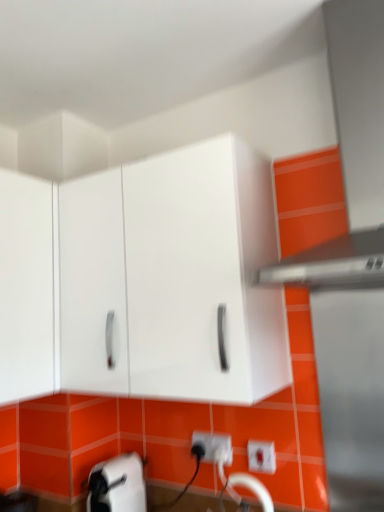
The width and height of the screenshot is (384, 512). What do you see at coordinates (350, 155) in the screenshot?
I see `satin silver exhaust hood at upper right` at bounding box center [350, 155].

The image size is (384, 512). Find the location of `white plastic electric outlet at lower center`. white plastic electric outlet at lower center is located at coordinates (213, 445).

The height and width of the screenshot is (512, 384). I want to click on white glossy cabinet at upper center, so click(x=173, y=277).

From a real-world perspective, is white plastic electric outlet at lower center located higher than satin silver exhaust hood at upper right?

Actually, white plastic electric outlet at lower center is physically below satin silver exhaust hood at upper right in the real world.

Is satin silver exhaust hood at upper right surrounded by white plastic electric outlet at lower center?

Actually, satin silver exhaust hood at upper right is outside white plastic electric outlet at lower center.

The width and height of the screenshot is (384, 512). I want to click on exhaust hood above the white plastic electric outlet at lower center (from the image's perspective), so click(x=350, y=155).

How far apart are white plastic electric outlet at lower center and satin silver exhaust hood at upper right?

They are 95.47 centimeters apart.

Considering the positions of objects white plastic electric outlet at lower center and white glossy cabinet at upper center in the image provided, who is in front, white plastic electric outlet at lower center or white glossy cabinet at upper center?

white glossy cabinet at upper center is more forward.

The height and width of the screenshot is (512, 384). Find the location of `cabinetry above the white plastic electric outlet at lower center (from the image's perspective)`. cabinetry above the white plastic electric outlet at lower center (from the image's perspective) is located at coordinates (173, 277).

Which is closer to the camera, (212,433) or (107,369)?

Point (212,433) is positioned farther from the camera compared to point (107,369).

Is white plastic electric outlet at lower center aimed at white glossy cabinet at upper center?

No, white plastic electric outlet at lower center is not oriented towards white glossy cabinet at upper center.

How different are the orientations of satin silver exhaust hood at upper right and white plastic electric outlet at lower center in degrees?

The facing directions of satin silver exhaust hood at upper right and white plastic electric outlet at lower center are 0.00731 degrees apart.

Does satin silver exhaust hood at upper right have a greater height compared to white plastic electric outlet at lower center?

Yes.

Is white plastic electric outlet at lower center a part of satin silver exhaust hood at upper right?

No, white plastic electric outlet at lower center is not surrounded by satin silver exhaust hood at upper right.

From the image's perspective, is satin silver exhaust hood at upper right located beneath white plastic electric outlet at lower center?

No, from the image's perspective, satin silver exhaust hood at upper right is not beneath white plastic electric outlet at lower center.

From the image's perspective, does white glossy cabinet at upper center appear higher than satin silver exhaust hood at upper right?

Incorrect, from the image's perspective, white glossy cabinet at upper center is lower than satin silver exhaust hood at upper right.

Is white glossy cabinet at upper center situated inside satin silver exhaust hood at upper right or outside?

white glossy cabinet at upper center is spatially situated outside satin silver exhaust hood at upper right.

Does white glossy cabinet at upper center have a lesser height compared to satin silver exhaust hood at upper right?

Indeed, white glossy cabinet at upper center has a lesser height compared to satin silver exhaust hood at upper right.

Which is behind, white glossy cabinet at upper center or white plastic electric outlet at lower center?

Positioned behind is white plastic electric outlet at lower center.

Looking at this image, from a real-world perspective, which object rests below the other?

In real-world perspective, white plastic electric outlet at lower center is lower.

Which of these two, satin silver exhaust hood at upper right or white glossy cabinet at upper center, is wider?

With larger width is satin silver exhaust hood at upper right.

Is satin silver exhaust hood at upper right not inside white glossy cabinet at upper center?

Yes, satin silver exhaust hood at upper right is not within white glossy cabinet at upper center.

From the image's perspective, which object appears higher, satin silver exhaust hood at upper right or white glossy cabinet at upper center?

satin silver exhaust hood at upper right, from the image's perspective.

From the picture: From a real-world perspective, is satin silver exhaust hood at upper right positioned above or below white glossy cabinet at upper center?

From a real-world perspective, satin silver exhaust hood at upper right is physically above white glossy cabinet at upper center.

This screenshot has width=384, height=512. I want to click on exhaust hood in front of the white plastic electric outlet at lower center, so click(350, 155).

Where is `cabinetry on the left of the white plastic electric outlet at lower center`? cabinetry on the left of the white plastic electric outlet at lower center is located at coordinates (173, 277).

Considering their positions, is white plastic electric outlet at lower center positioned further to white glossy cabinet at upper center than satin silver exhaust hood at upper right?

white plastic electric outlet at lower center.

When comparing their distances from white glossy cabinet at upper center, does satin silver exhaust hood at upper right or white plastic electric outlet at lower center seem further?

The object further to white glossy cabinet at upper center is white plastic electric outlet at lower center.

From the image, which object appears to be farther from white plastic electric outlet at lower center, white glossy cabinet at upper center or satin silver exhaust hood at upper right?

Based on the image, satin silver exhaust hood at upper right appears to be further to white plastic electric outlet at lower center.

Consider the image. Estimate the real-world distances between objects in this image. Which object is further from white plastic electric outlet at lower center, satin silver exhaust hood at upper right or white glossy cabinet at upper center?

The object further to white plastic electric outlet at lower center is satin silver exhaust hood at upper right.

Which object lies further to the anchor point satin silver exhaust hood at upper right, white glossy cabinet at upper center or white plastic electric outlet at lower center?

Result: white plastic electric outlet at lower center is further to satin silver exhaust hood at upper right.

Looking at the image, which one is located closer to satin silver exhaust hood at upper right, white plastic electric outlet at lower center or white glossy cabinet at upper center?

white glossy cabinet at upper center is closer to satin silver exhaust hood at upper right.

Locate an element on the screen. cabinetry between satin silver exhaust hood at upper right and white plastic electric outlet at lower center in the up-down direction is located at coordinates (173, 277).